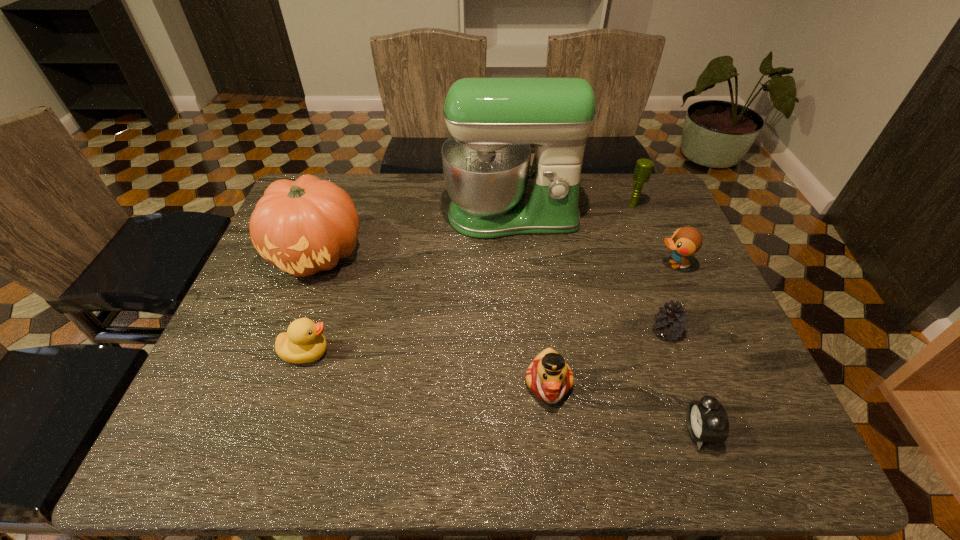
The width and height of the screenshot is (960, 540). I want to click on vacant position located 0.320m on the left of the microphone, so click(524, 205).

The image size is (960, 540). I want to click on free location located on the front-facing side of the rightmost duck, so click(x=558, y=265).

Image resolution: width=960 pixels, height=540 pixels. Identify the location of vacant position located 0.210m on the front-facing side of the rightmost duck. (580, 265).

Identify the location of free location located on the front-facing side of the rightmost duck. This screenshot has width=960, height=540. (605, 265).

This screenshot has height=540, width=960. What are the coordinates of `blank space located 0.060m on the face of the second duck from right to left` in the screenshot? It's located at (555, 436).

The height and width of the screenshot is (540, 960). Find the location of `vacant point located at the beak of the leftmost duck`. vacant point located at the beak of the leftmost duck is located at coordinates (470, 353).

Find the location of a particular element. The image size is (960, 540). vacant area located 0.050m on the back of the pinecone is located at coordinates (656, 303).

Locate an element on the screen. vacant space situated 0.060m on the front side of the alarm clock is located at coordinates click(x=657, y=430).

This screenshot has width=960, height=540. What are the coordinates of `free spot located 0.400m on the front side of the alarm clock` in the screenshot? It's located at (487, 430).

Where is `vacant space located 0.280m on the front side of the alarm clock`? vacant space located 0.280m on the front side of the alarm clock is located at coordinates [547, 430].